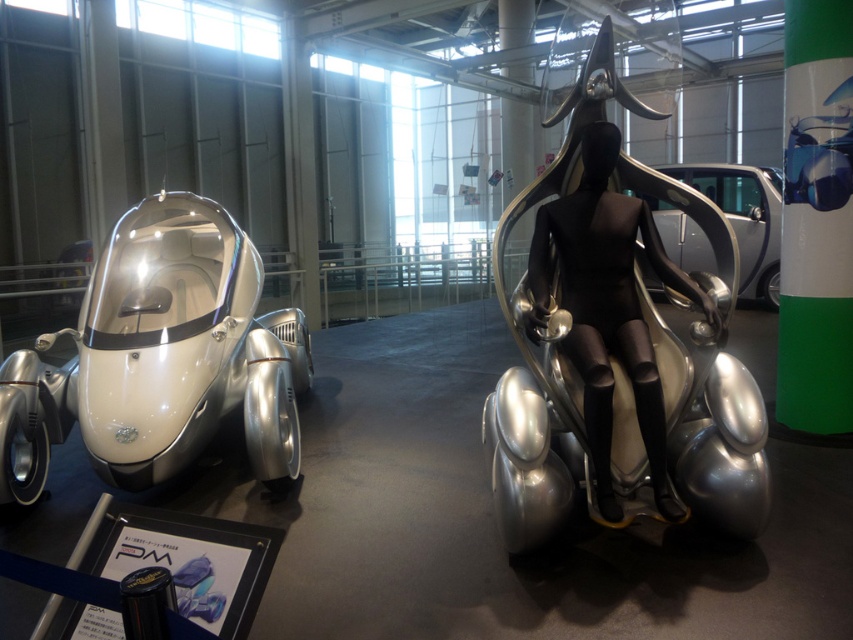
You are standing in the exhibit and want to take a photo of the silver metallic concept car at left. If your camera has a maximum focus range of 3 meters, will it be able to capture the car clearly?

The silver metallic concept car at left is 2.92 meters away from the camera, which is within the 3 meter maximum focus range. Therefore, the camera should be able to capture the car clearly.

You are an interior designer planning to place a new sofa in the exhibit. You need to ensure it fits between the silver metallic chair at center and the silver metallic concept car at left. If the sofa is 1.2 meters wide, can it fit in the space between them?

The silver metallic chair at center has a lesser width compared to the silver metallic concept car at left. Since the chair is narrower than the car, the space between them might accommodate the sofa. However, without knowing the exact distance between the two objects, it is impossible to confirm if the 1.2 meter sofa will fit. Additional measurements of the gap are required for an accurate assessment.